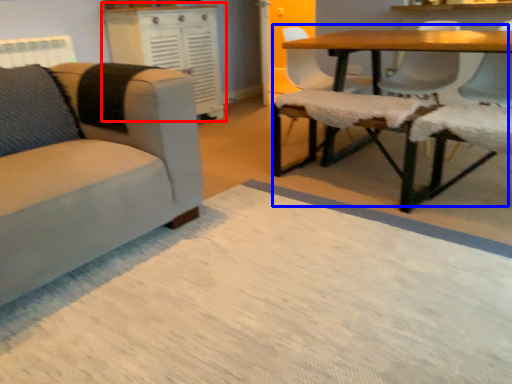
Question: Which point is closer to the camera, dresser (highlighted by a red box) or table (highlighted by a blue box)?

Choices:
 (A) dresser
 (B) table

Answer: (B)